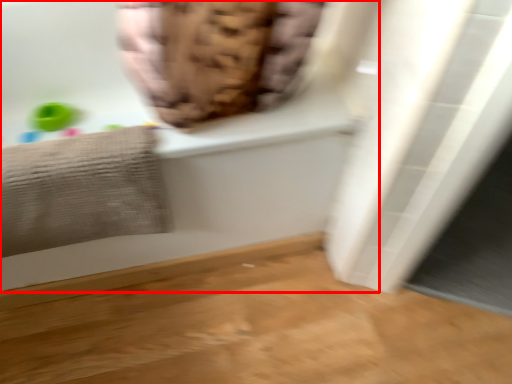
Question: Observing the image, what is the correct spatial positioning of bathtub (annotated by the red box) in reference to towel?

Choices:
 (A) right
 (B) left

Answer: (A)